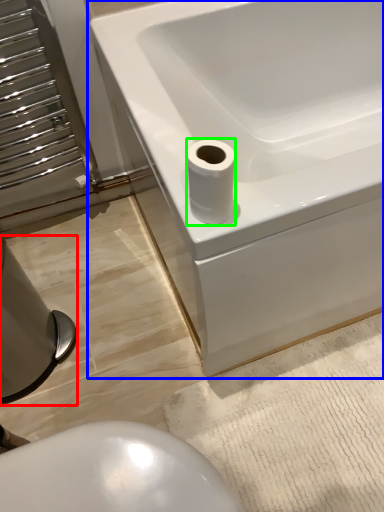
Question: Considering the real-world distances, which object is closest to bidet (highlighted by a red box)? bathtub (highlighted by a blue box) or toilet paper (highlighted by a green box).

Choices:
 (A) bathtub
 (B) toilet paper

Answer: (A)